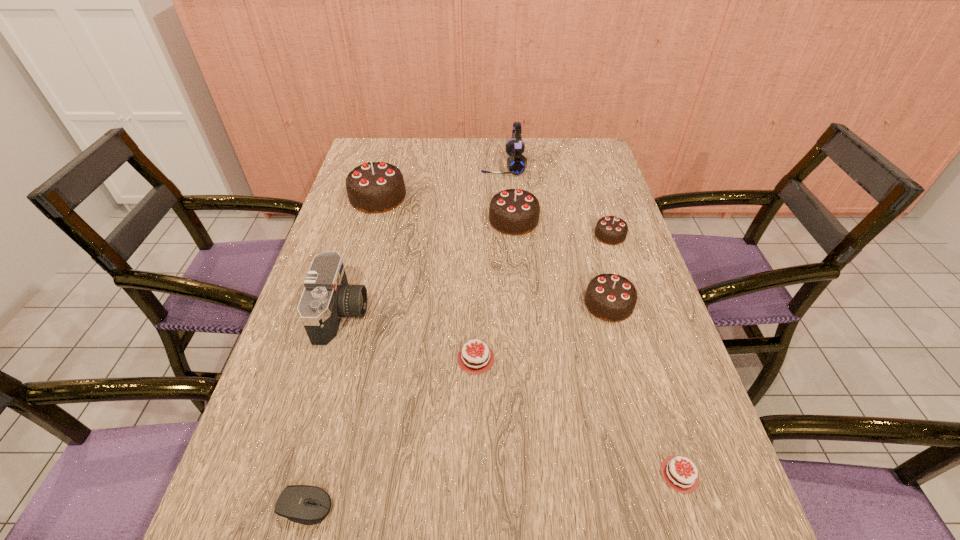
Find the location of a particular element. The width and height of the screenshot is (960, 540). free space that satisfies the following two spatial constraints: 1. on the front side of the second tallest chocolate cake; 2. on the left side of the sixth farthest chocolate cake is located at coordinates (536, 475).

This screenshot has width=960, height=540. In order to click on free spot that satisfies the following two spatial constraints: 1. on the ear cushions of the smallest chocolate chocolate cake; 2. on the left side of the farthest object in this screenshot , I will do [x=508, y=235].

I want to click on free space that satisfies the following two spatial constraints: 1. on the ear cushions of the farthest object; 2. on the back side of the sixth shortest chocolate cake, so click(x=507, y=220).